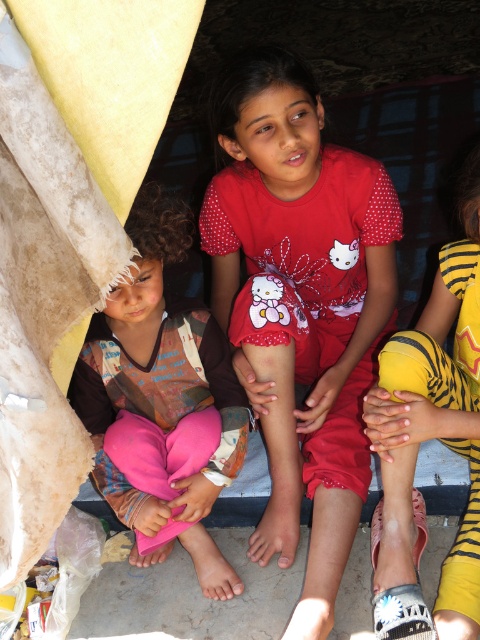
Is pink fabric pants at left wider than yellow tiger-patterned pants at lower right?

Yes, pink fabric pants at left is wider than yellow tiger-patterned pants at lower right.

This screenshot has width=480, height=640. I want to click on pink fabric pants at left, so click(163, 396).

Locate an element on the screen. The image size is (480, 640). pink fabric pants at left is located at coordinates (163, 396).

Is red matte shirt at center wider than pink fabric pants at left?

Yes.

Can you confirm if red matte shirt at center is positioned below pink fabric pants at left?

No.

Where is `red matte shirt at center`? Image resolution: width=480 pixels, height=640 pixels. red matte shirt at center is located at coordinates (300, 304).

How far apart are red matte shirt at center and yellow tiger-patterned pants at lower right?

A distance of 12.16 inches exists between red matte shirt at center and yellow tiger-patterned pants at lower right.

Who is more forward, (235, 301) or (400, 566)?

Point (400, 566) is more forward.

Who is more forward, (365, 330) or (437, 355)?

Point (437, 355) is in front.

The width and height of the screenshot is (480, 640). I want to click on red matte shirt at center, so click(x=300, y=304).